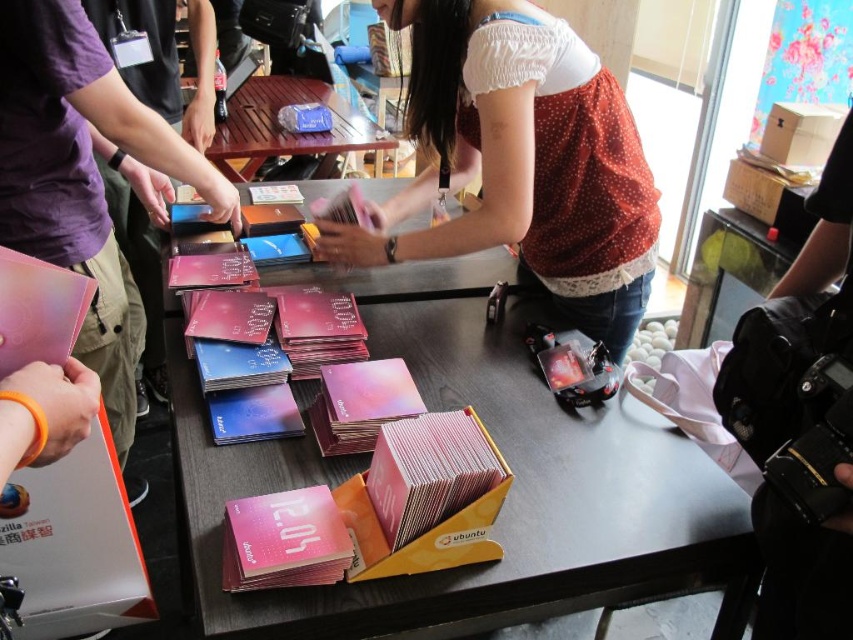
What is the color of the object located at point (86, 177) in the image?

The object at point (86, 177) is a matte pink card.

You are organizing a tech event and need to place a new sign that is 20 inches wide between the two items on the table. The items are the matte pink card at left and the stack of Ubuntu 12.04 brochures. Can the sign fit between them without overlapping either item?

The distance between the matte pink card at left and the stack of Ubuntu 12.04 brochures is 39.03 inches. Since the sign is only 20 inches wide, there is enough space to place it between them without overlapping either item.

You are organizing promotional materials at a tech event. You see a matte pink card at left and a matte black laptop at left. Which item is positioned lower on the table?

The matte pink card at left is located below the matte black laptop at left, so it is positioned lower on the table.